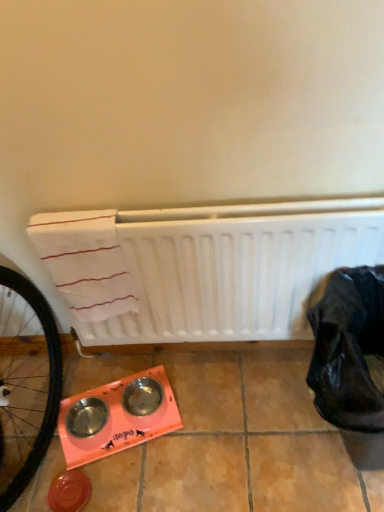
Question: Considering the positions of black fabric bag at lower right and white matte radiator at center in the image, is black fabric bag at lower right taller or shorter than white matte radiator at center?

Choices:
 (A) short
 (B) tall

Answer: (A)

Question: Considering the positions of black fabric bag at lower right and white matte radiator at center in the image, is black fabric bag at lower right wider or thinner than white matte radiator at center?

Choices:
 (A) thin
 (B) wide

Answer: (B)

Question: From a real-world perspective, relative to white matte radiator at center, is black fabric bag at lower right vertically above or below?

Choices:
 (A) below
 (B) above

Answer: (A)

Question: Is white matte radiator at center situated inside black fabric bag at lower right or outside?

Choices:
 (A) inside
 (B) outside

Answer: (B)

Question: From a real-world perspective, relative to black fabric bag at lower right, is white matte radiator at center vertically above or below?

Choices:
 (A) below
 (B) above

Answer: (B)

Question: Based on their positions, is white matte radiator at center located to the left or right of black fabric bag at lower right?

Choices:
 (A) right
 (B) left

Answer: (B)

Question: In the image, is white matte radiator at center positioned in front of or behind black fabric bag at lower right?

Choices:
 (A) behind
 (B) front

Answer: (A)